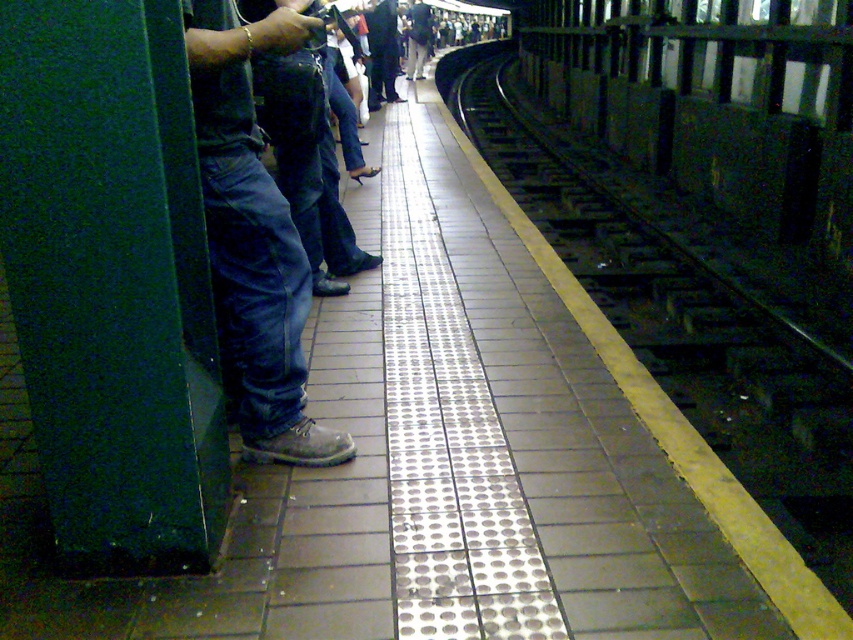
Question: Among these objects, which one is nearest to the camera?

Choices:
 (A) light gray pants at center
 (B) metal/textured train track at right
 (C) dark blue jeans at center
 (D) dark gray concrete train at right

Answer: (B)

Question: Can you confirm if dark gray concrete train at right is positioned to the left of dark blue jeans at center?

Choices:
 (A) no
 (B) yes

Answer: (A)

Question: Does denim jeans at left lie behind dark blue jeans at center?

Choices:
 (A) yes
 (B) no

Answer: (B)

Question: Which object is closer to the camera taking this photo?

Choices:
 (A) dark blue jeans at center
 (B) metal/textured train track at right
 (C) denim jeans at left
 (D) light gray pants at center

Answer: (C)

Question: Which point is closer to the camera?

Choices:
 (A) (724, 17)
 (B) (421, 33)

Answer: (A)

Question: Can you confirm if dark gray concrete train at right is smaller than light gray pants at center?

Choices:
 (A) no
 (B) yes

Answer: (B)